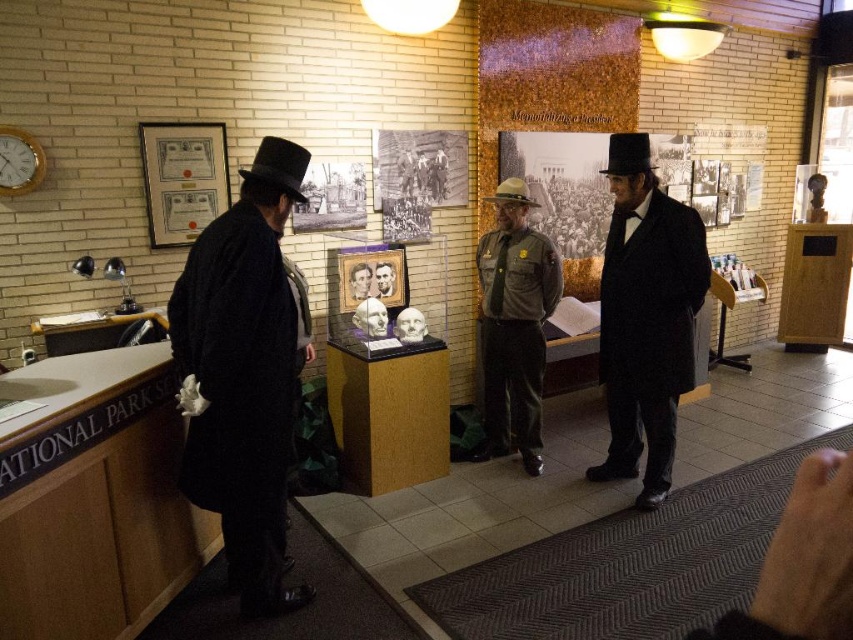
Question: Which of the following is the closest to the observer?

Choices:
 (A) (502, 184)
 (B) (660, 216)
 (C) (381, 328)

Answer: (B)

Question: Can you confirm if black felt dress hat at upper right is positioned to the right of brown felt dress hat at center?

Choices:
 (A) yes
 (B) no

Answer: (A)

Question: Does black felt dress hat at left have a larger size compared to matte white bust at center?

Choices:
 (A) yes
 (B) no

Answer: (A)

Question: Based on their relative distances, which object is nearer to the matte white bust at center?

Choices:
 (A) black felt dress hat at upper right
 (B) smooth brown leather hat at center
 (C) brown felt dress hat at center
 (D) matte black coat at center

Answer: (B)

Question: Among these objects, which one is nearest to the camera?

Choices:
 (A) brown uniform at center
 (B) matte black coat at center
 (C) matte white bust at center
 (D) black felt dress hat at upper right

Answer: (B)

Question: Does matte black coat at left have a larger size compared to matte white bust at center?

Choices:
 (A) yes
 (B) no

Answer: (A)